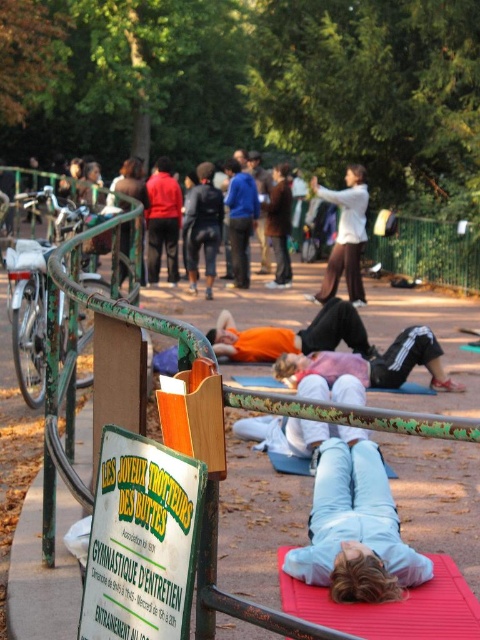
You are a painter who needs to decide which object to paint first between the green painted metal rail at center and the white matte jacket at center. Based on their sizes, which one requires more paint?

The white matte jacket at center requires more paint because it occupies more space than the green painted metal rail at center.

Looking at this image, you are a park visitor who wants to place both the green paper sign at lower left and the red rubber yoga mat at lower center on a shelf that can only hold items with a combined width of 1 meter. Given their widths, can both items fit together on the shelf?

The green paper sign at lower left has a lesser width compared to red rubber yoga mat at lower center. If the yoga mat is wider than 0.5 meters, their combined width would exceed 1 meter, so they might not fit. However, without exact measurements, it is uncertain. Please check the exact widths.

You are a hiker who just arrived at the park and see the red rubber yoga mat at lower center and the white matte jacket at center. You want to pick up the jacket first. Which object should you move towards first?

You should move towards the red rubber yoga mat at lower center first because it is closer to you than the white matte jacket at center, so you can reach it before the jacket.